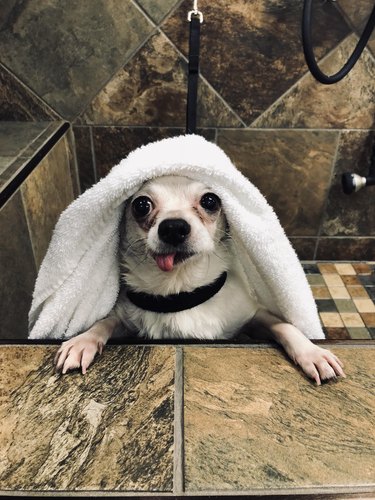
I want to click on tiles, so click(234, 432), click(127, 429), click(63, 162), click(19, 278).